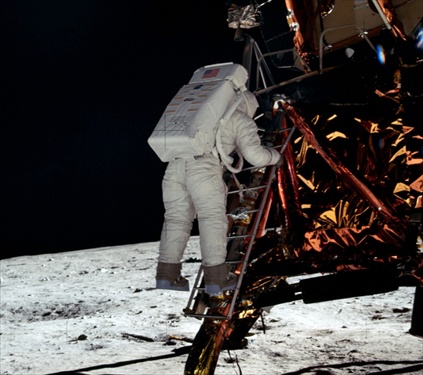
Where is `ladder legs`? ladder legs is located at coordinates (x=217, y=319), (x=227, y=287), (x=232, y=260), (x=240, y=234), (x=250, y=210), (x=256, y=188), (x=250, y=168), (x=276, y=142), (x=282, y=128).